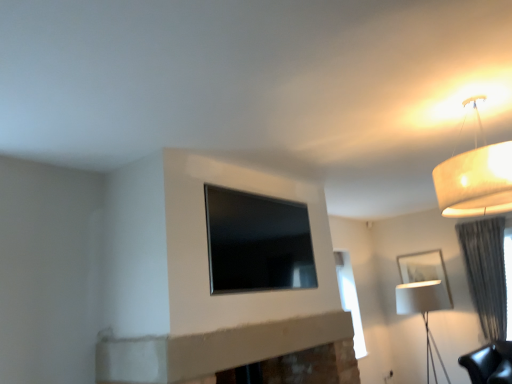
Locate an element on the screen. This screenshot has width=512, height=384. empty space that is ontop of matte white lampshade at upper right, the second lamp when ordered from bottom to top is located at coordinates (461, 105).